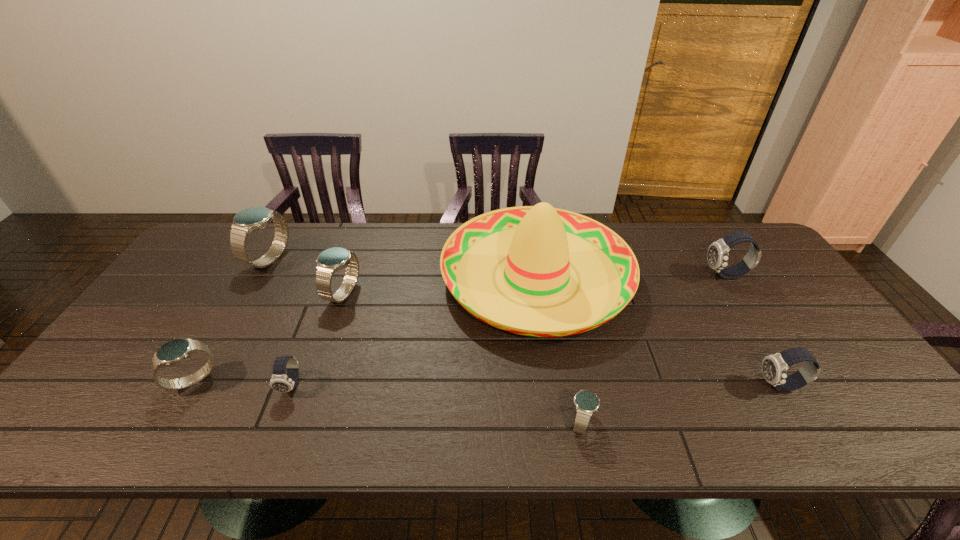
This screenshot has height=540, width=960. I want to click on vacant space positioned 0.220m on the front of the tallest object, so click(559, 430).

The width and height of the screenshot is (960, 540). What are the coordinates of `free space located 0.300m on the right of the biggest blue watch` in the screenshot? It's located at (381, 260).

The height and width of the screenshot is (540, 960). What are the coordinates of `vacant space located on the face of the biggest dark watch` in the screenshot? It's located at (672, 275).

This screenshot has height=540, width=960. Identify the location of free location located on the face of the biggest dark watch. (620, 275).

Where is `free space located on the face of the biggest dark watch`? free space located on the face of the biggest dark watch is located at coordinates (581, 275).

Where is `free space located on the left of the second biggest blue watch`? This screenshot has height=540, width=960. free space located on the left of the second biggest blue watch is located at coordinates tap(252, 294).

Identify the location of free spot located on the face of the second smallest dark watch. The width and height of the screenshot is (960, 540). (738, 386).

Find the location of a particular element. free location located on the face of the second smallest dark watch is located at coordinates [x=625, y=386].

Find the location of a particular element. The width and height of the screenshot is (960, 540). vacant space located on the face of the second smallest dark watch is located at coordinates (641, 386).

This screenshot has height=540, width=960. In order to click on vacant space situated 0.280m on the back of the third farthest blue watch in this screenshot , I will do `click(248, 288)`.